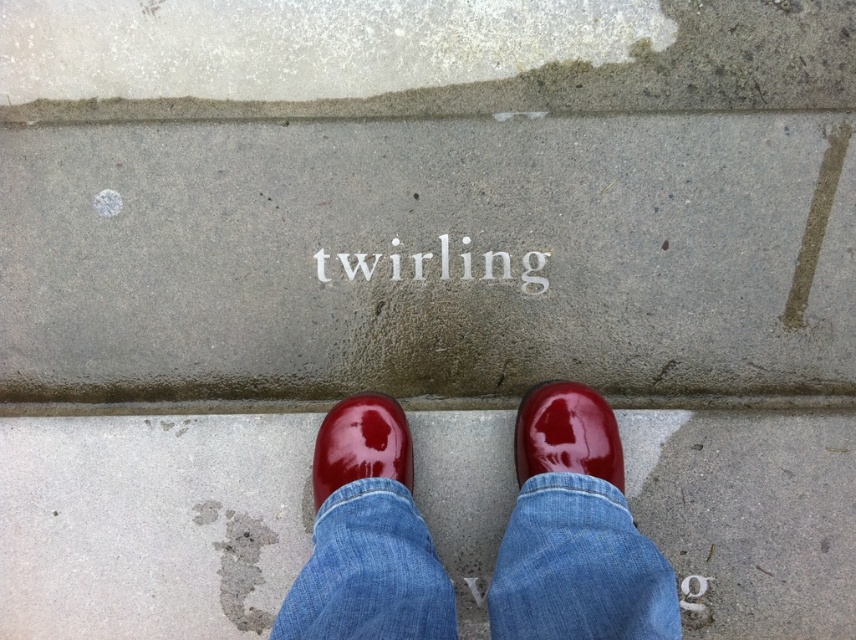
You are designing a poster and need to place two elements based on their sizes. The blue denim jeans at center and the glossy red shoe at center must be arranged so that the larger one is placed above the smaller one. Which object should be placed above the other?

The blue denim jeans at center is bigger than the glossy red shoe at center, so the blue denim jeans at center should be placed above the glossy red shoe at center.

You are trying to determine which item is taller between the blue denim jeans at center and the glossy red shoe at center. Based on the scene description, which one is taller?

The blue denim jeans at center has a greater height compared to the glossy red shoe at center, so the blue denim jeans at center is taller.